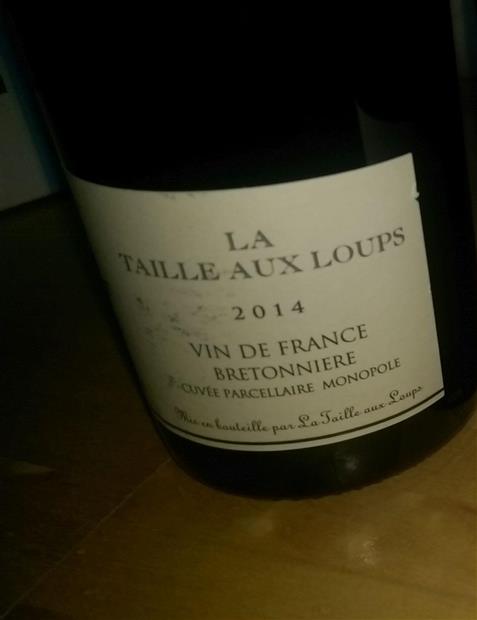
Where is `wooden table`? Image resolution: width=477 pixels, height=620 pixels. wooden table is located at coordinates (221, 555).